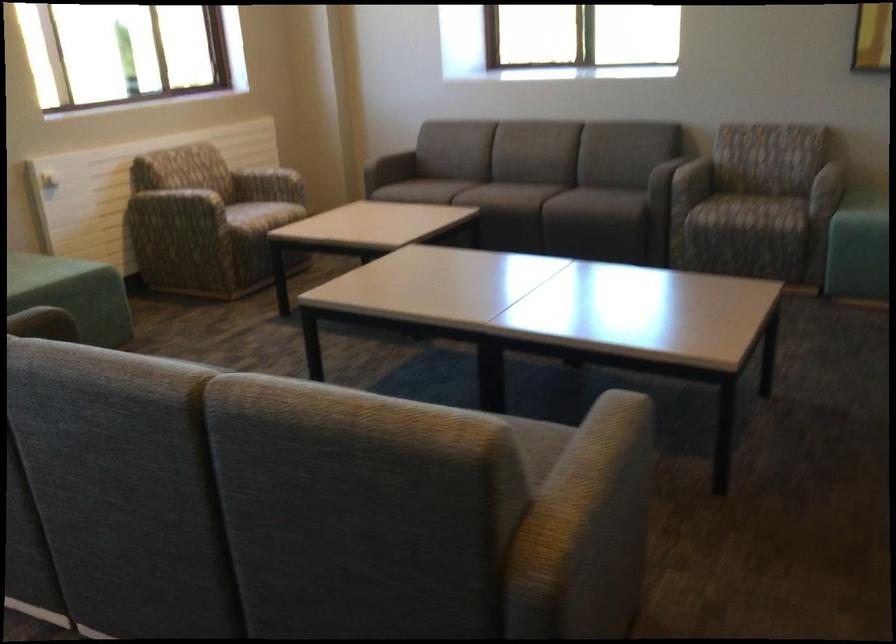
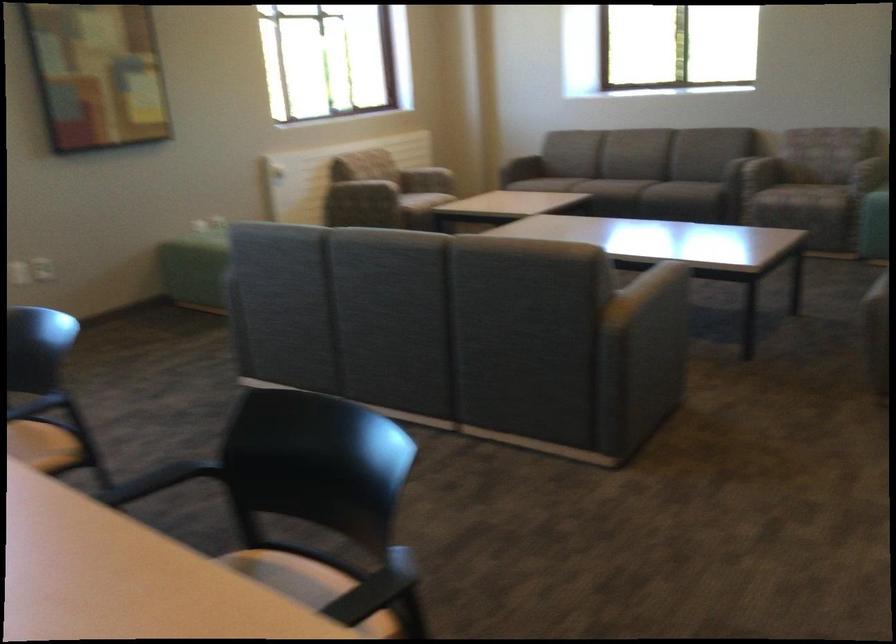
Locate, in the second image, the point that corresponds to point 757,205 in the first image.

(807, 184)